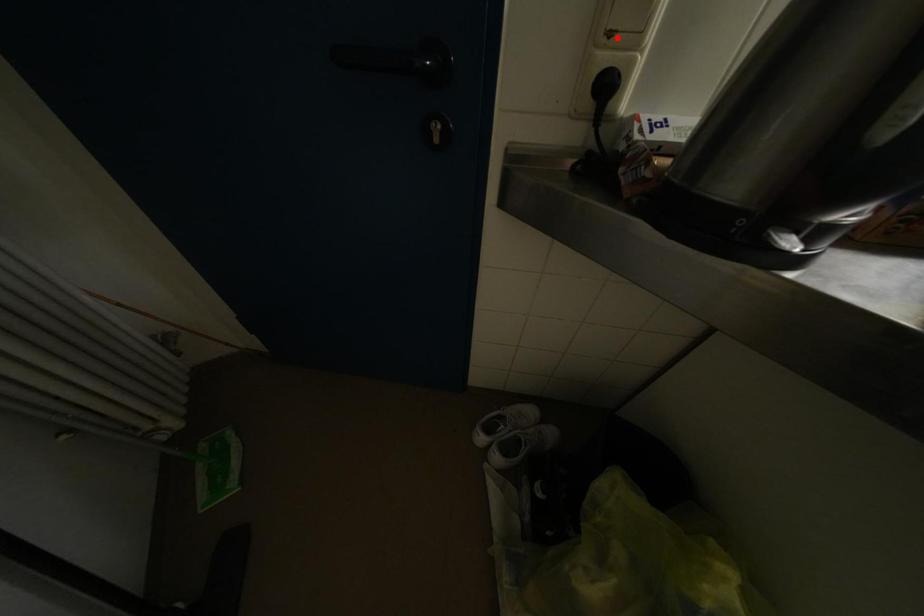
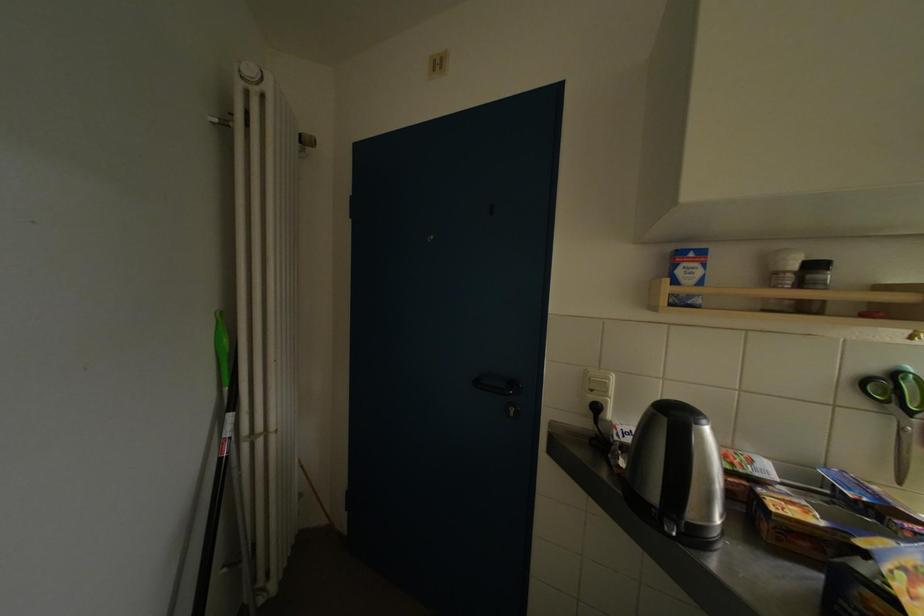
In the second image, find the point that corresponds to the highlighted location in the first image.

(599, 394)